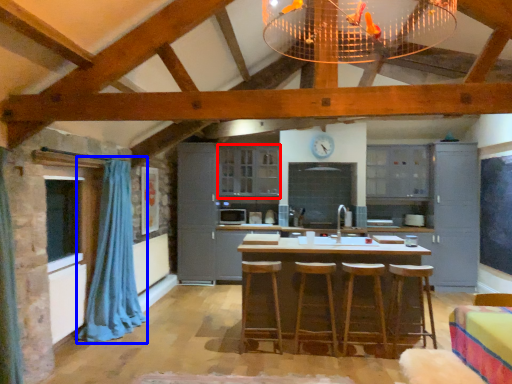
Question: Which object appears farthest to the camera in this image, cabinetry (highlighted by a red box) or curtain (highlighted by a blue box)?

Choices:
 (A) cabinetry
 (B) curtain

Answer: (A)